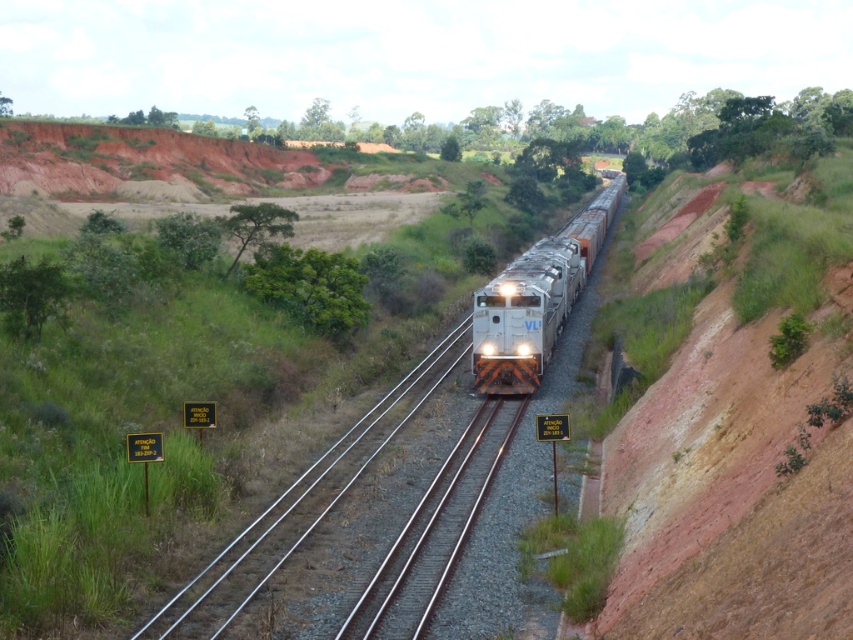
Is metal/smooth train track at center thinner than silver metallic train at center?

Correct, metal/smooth train track at center's width is less than silver metallic train at center's.

Is metal/smooth train track at center smaller than silver metallic train at center?

Yes.

This screenshot has height=640, width=853. In order to click on metal/smooth train track at center in this screenshot , I will do `click(434, 531)`.

Locate an element on the screen. The width and height of the screenshot is (853, 640). metal/smooth train track at center is located at coordinates (434, 531).